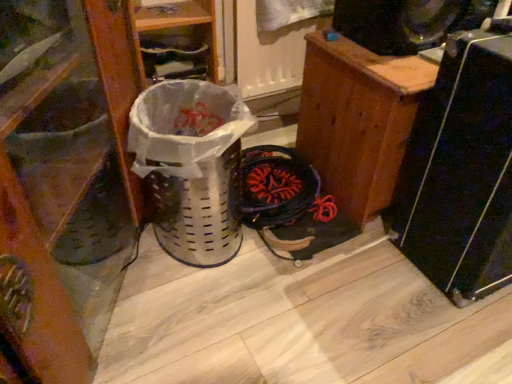
Question: Is black plastic speaker at right taller than wooden shoe at left, arranged as the 1th furniture when viewed from the left?

Choices:
 (A) no
 (B) yes

Answer: (A)

Question: From a real-world perspective, is black plastic speaker at right physically below wooden shoe at left, arranged as the 1th furniture when viewed from the left?

Choices:
 (A) yes
 (B) no

Answer: (A)

Question: Does black plastic speaker at right come in front of wooden shoe at left, arranged as the 1th furniture when viewed from the left?

Choices:
 (A) yes
 (B) no

Answer: (B)

Question: Is black plastic speaker at right directly adjacent to wooden shoe at left, arranged as the 1th furniture when viewed from the left?

Choices:
 (A) no
 (B) yes

Answer: (A)

Question: From a real-world perspective, is black plastic speaker at right physically above wooden shoe at left, acting as the second furniture starting from the right?

Choices:
 (A) yes
 (B) no

Answer: (B)

Question: Is point (503, 193) closer or farther from the camera than point (40, 9)?

Choices:
 (A) farther
 (B) closer

Answer: (A)

Question: In terms of width, does black plastic speaker at right look wider or thinner when compared to wooden shoe at left, acting as the second furniture starting from the right?

Choices:
 (A) wide
 (B) thin

Answer: (B)

Question: Is black plastic speaker at right bigger or smaller than wooden shoe at left, arranged as the 1th furniture when viewed from the left?

Choices:
 (A) small
 (B) big

Answer: (A)

Question: Would you say black plastic speaker at right is to the left or to the right of wooden shoe at left, arranged as the 1th furniture when viewed from the left, in the picture?

Choices:
 (A) left
 (B) right

Answer: (B)

Question: From their relative heights in the image, would you say wooden cabinet at right, which ranks as the second furniture in left-to-right order, is taller or shorter than white plastic basket at center?

Choices:
 (A) tall
 (B) short

Answer: (A)

Question: Looking at their shapes, would you say wooden cabinet at right, which ranks as the second furniture in left-to-right order, is wider or thinner than white plastic basket at center?

Choices:
 (A) thin
 (B) wide

Answer: (B)

Question: From a real-world perspective, relative to white plastic basket at center, is wooden cabinet at right, which ranks as the second furniture in left-to-right order, vertically above or below?

Choices:
 (A) above
 (B) below

Answer: (A)

Question: Would you say wooden cabinet at right, the first furniture when ordered from right to left, is to the left or to the right of white plastic basket at center in the picture?

Choices:
 (A) left
 (B) right

Answer: (B)

Question: Is wooden shoe at left, acting as the second furniture starting from the right, in front of or behind white plastic basket at center in the image?

Choices:
 (A) front
 (B) behind

Answer: (A)

Question: Considering the positions of wooden shoe at left, acting as the second furniture starting from the right, and white plastic basket at center in the image, is wooden shoe at left, acting as the second furniture starting from the right, taller or shorter than white plastic basket at center?

Choices:
 (A) tall
 (B) short

Answer: (A)